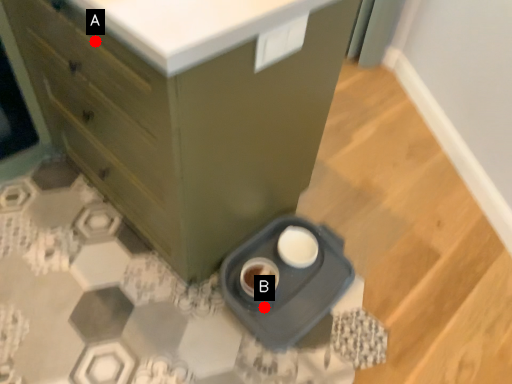
Question: Two points are circled on the image, labeled by A and B beside each circle. Which point is further to the camera?

Choices:
 (A) A is further
 (B) B is further

Answer: (B)